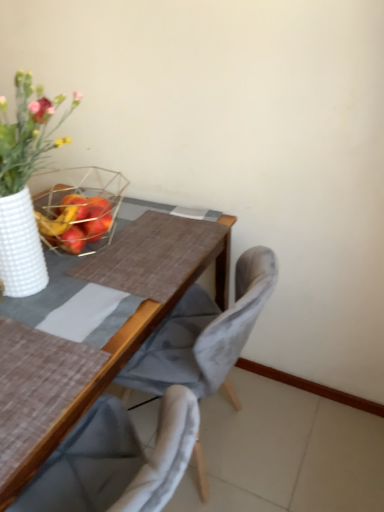
Identify the location of empty space that is ontop of brown textured table at center. The image size is (384, 512). (97, 271).